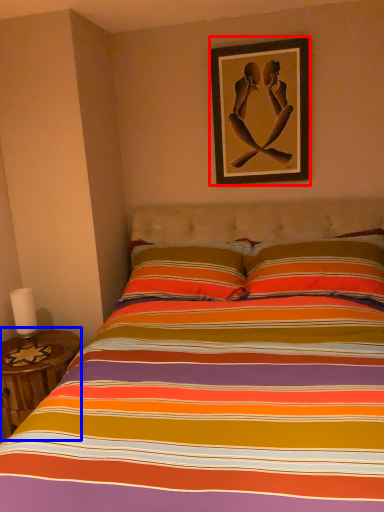
Question: Which of the following is the closest to the observer, picture frame (highlighted by a red box) or table (highlighted by a blue box)?

Choices:
 (A) picture frame
 (B) table

Answer: (B)